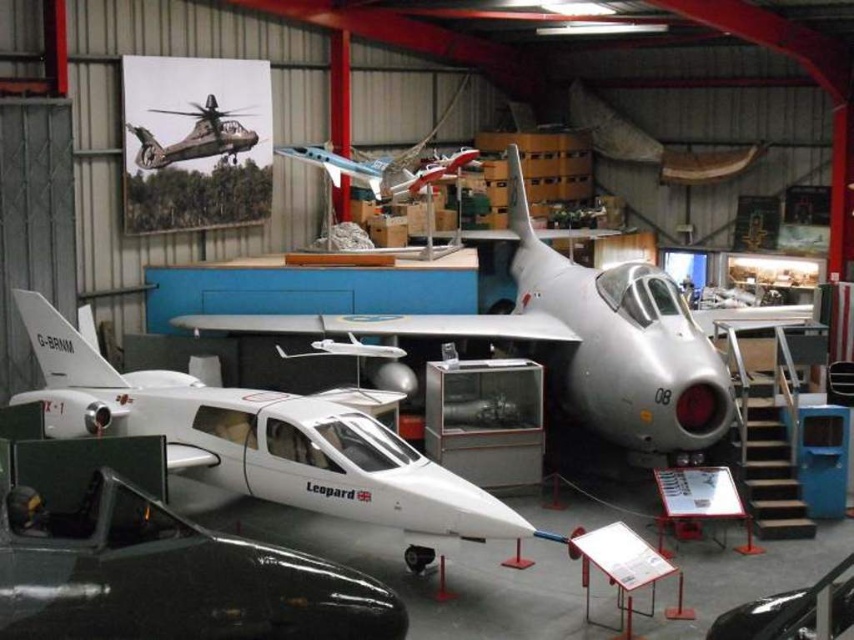
Question: Which object appears closest to the camera in this image?

Choices:
 (A) glossy white airplane at center
 (B) camouflage fabric helicopter at upper left
 (C) silver metallic airplane at center

Answer: (A)

Question: Is glossy white airplane at center behind camouflage fabric helicopter at upper left?

Choices:
 (A) no
 (B) yes

Answer: (A)

Question: Among these points, which one is nearest to the camera?

Choices:
 (A) (150, 140)
 (B) (332, 627)
 (C) (472, 321)
 (D) (458, 161)

Answer: (B)

Question: Among these objects, which one is farthest from the camera?

Choices:
 (A) camouflage fabric helicopter at upper left
 (B) glossy white airplane at center
 (C) silver metallic airplane at center

Answer: (A)

Question: Observing the image, what is the correct spatial positioning of metallic blue airplane at center in reference to camouflage fabric helicopter at upper left?

Choices:
 (A) left
 (B) right

Answer: (B)

Question: Considering the relative positions of metallic blue airplane at center and camouflage fabric helicopter at upper left in the image provided, where is metallic blue airplane at center located with respect to camouflage fabric helicopter at upper left?

Choices:
 (A) left
 (B) right

Answer: (B)